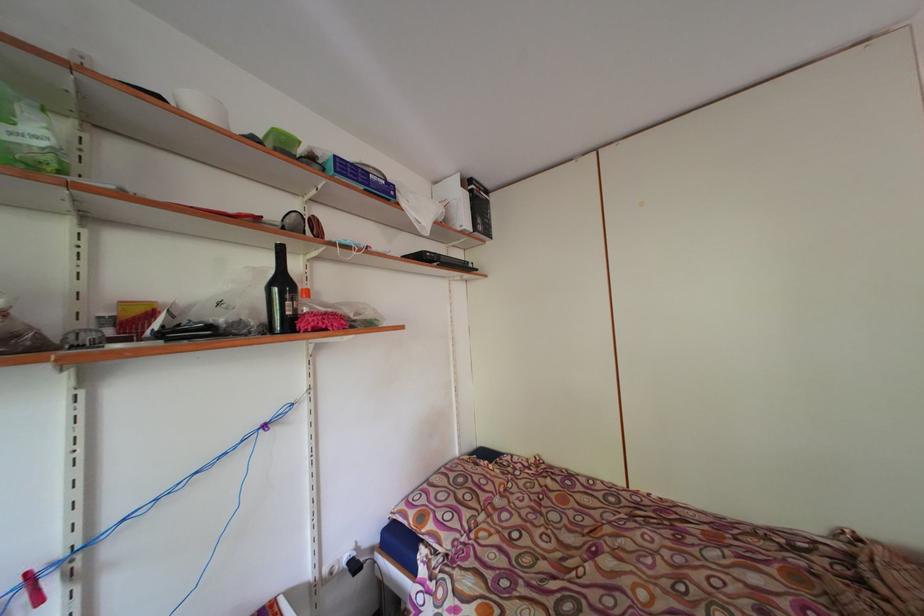
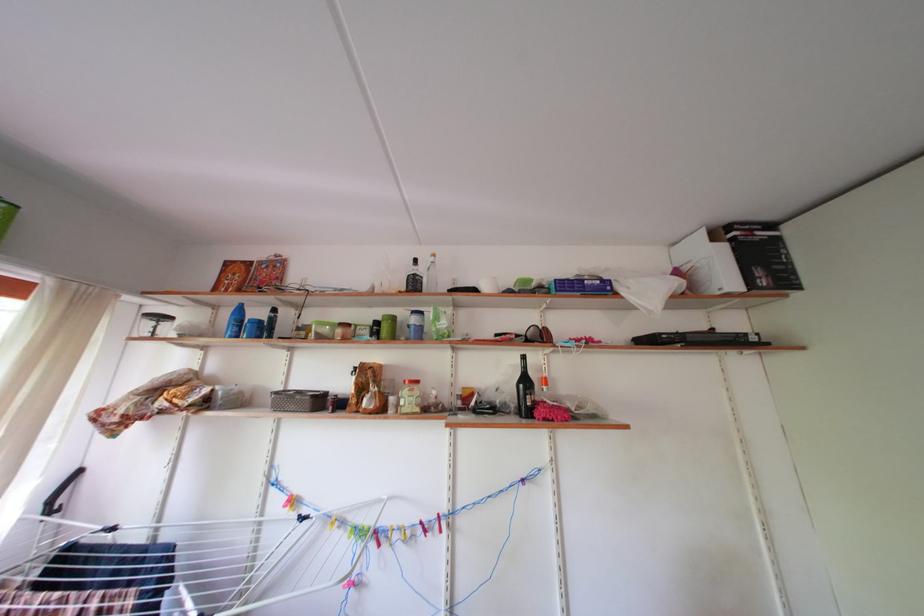
Find the pixel in the second image that matches (x=488, y=228) in the first image.

(768, 278)